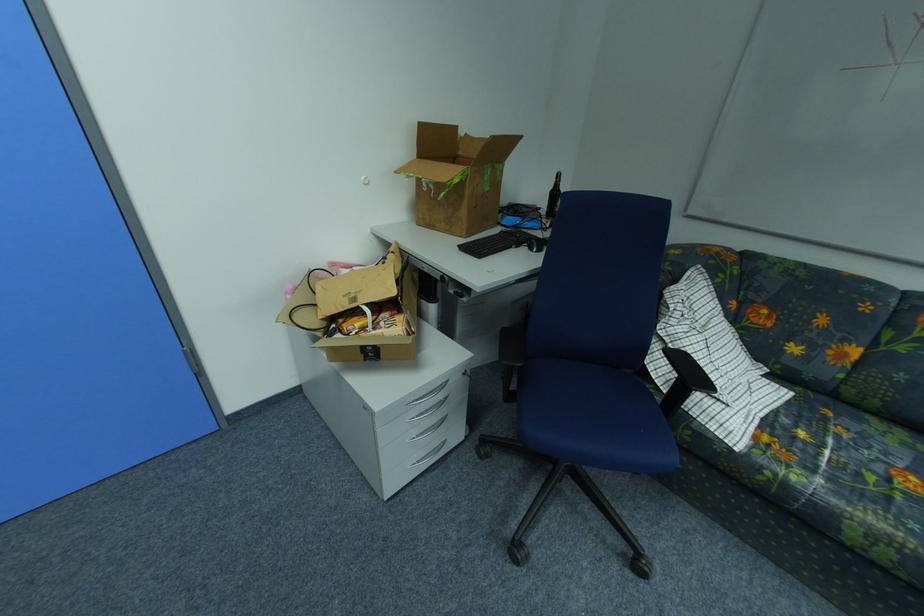
At what (x,y) coordinates should I click in order to perform the action: click on black chair armrest. Please return your answer as a coordinate pair (x, y). The height and width of the screenshot is (616, 924). Looking at the image, I should click on (688, 371).